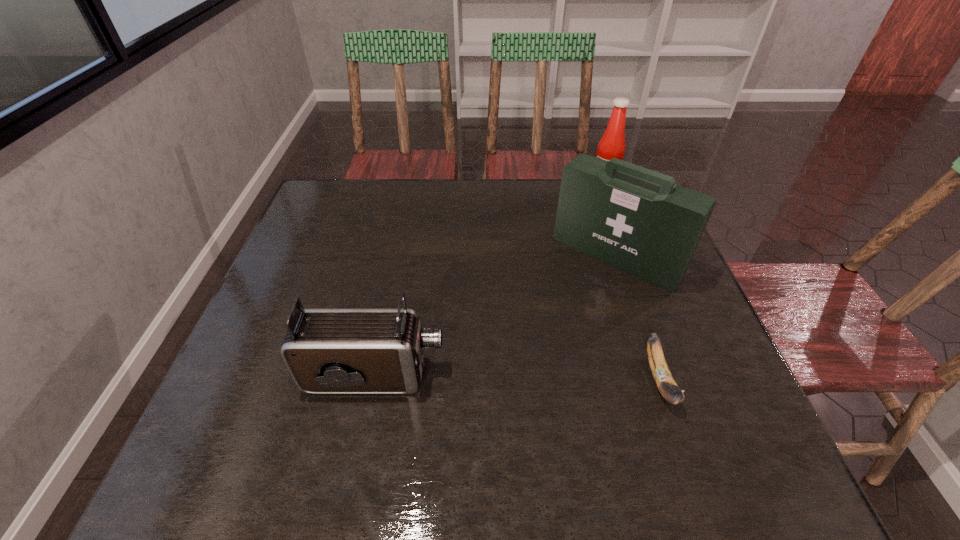
At what (x,y) coordinates should I click in order to perform the action: click on free space on the desktop that is between the leftmost object and the banana and is positioned on the front-facing side of the third nearest object. Please return your answer as a coordinate pair (x, y). The image size is (960, 540). Looking at the image, I should click on (514, 377).

The width and height of the screenshot is (960, 540). Identify the location of free space on the desktop that is between the third tallest object and the shortest object and is positioned on the front-facing side of the condiment. (525, 378).